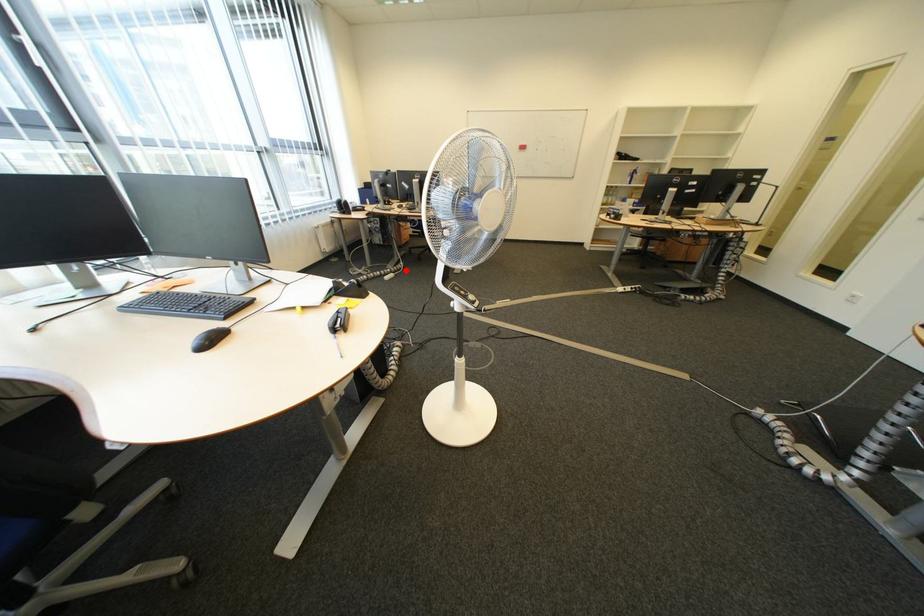
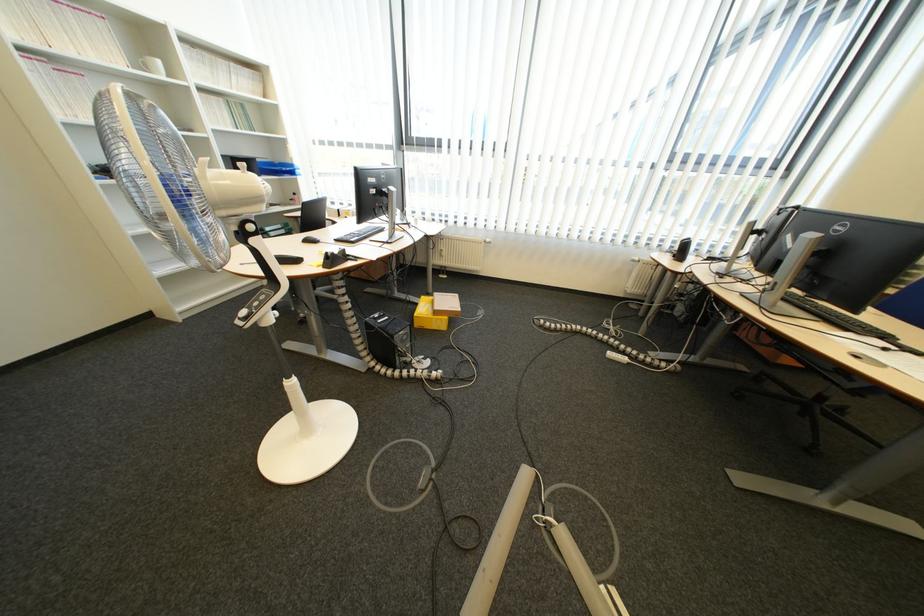
Find the pixel in the second image that matches the highlighted location in the first image.

(654, 358)